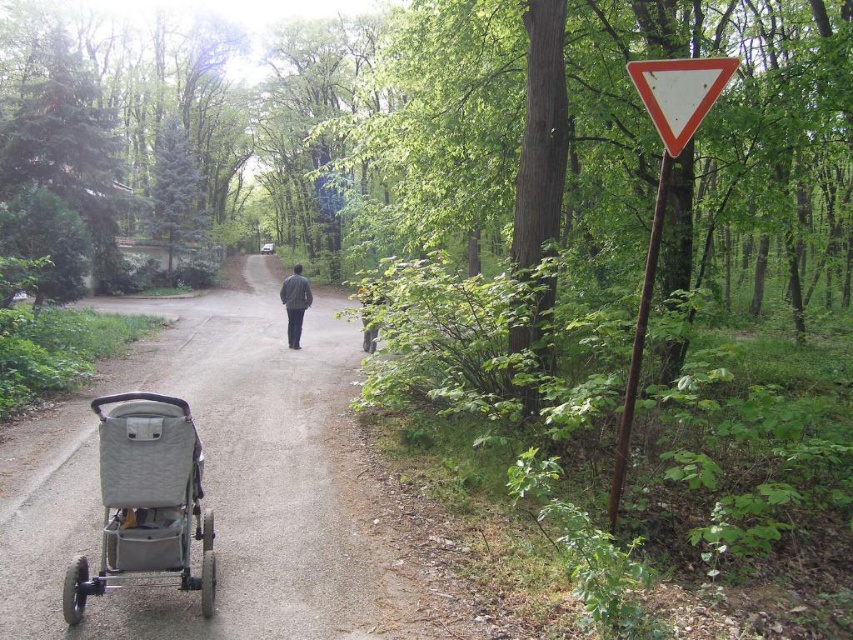
You are standing at the stroller with a light colored cover on the left side of the path in the park. You want to walk towards the person dressed in dark clothing walking away from the camera down the path. Which point, point [305,444] or point [132,524], is closer to you as you start walking?

Point [305,444] is closer to you because it is further to the camera than point [132,524], meaning it is nearer in your current position.

In the scene shown: You are a child playing in the park and see the white plastic triangle at right and the white plastic triangle at upper right. Which one is taller?

The white plastic triangle at right is much taller than the white plastic triangle at upper right.